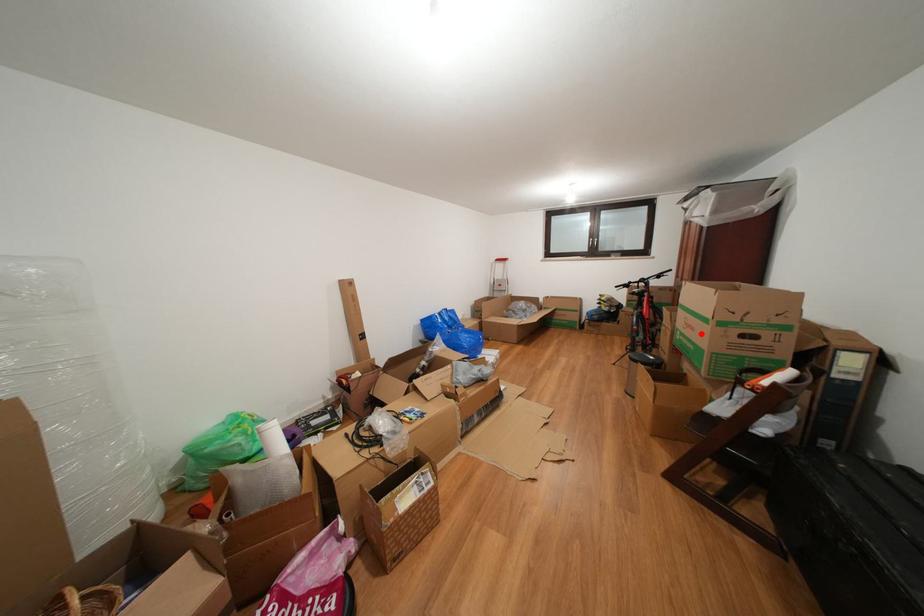
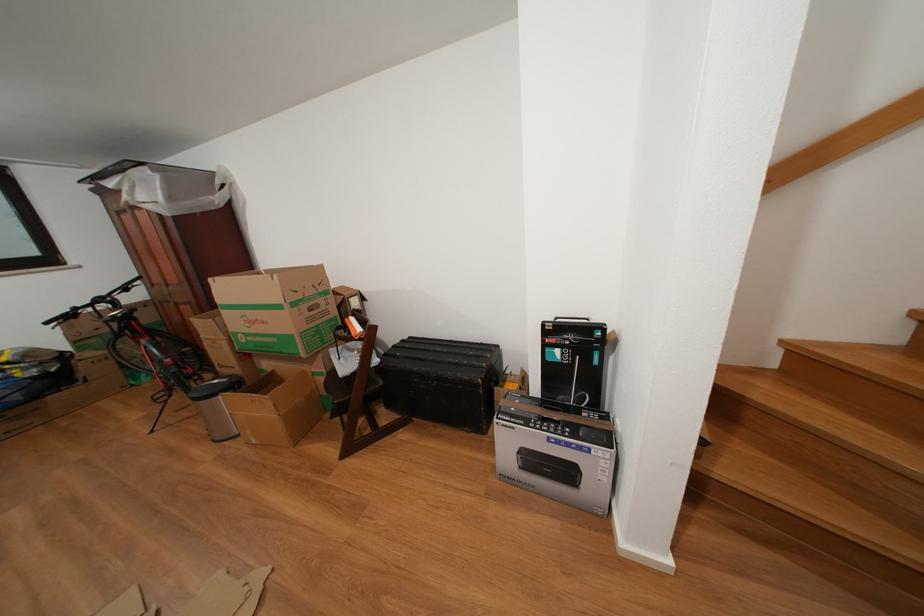
Locate, in the second image, the point that corresponds to the highlighted location in the first image.

(272, 328)